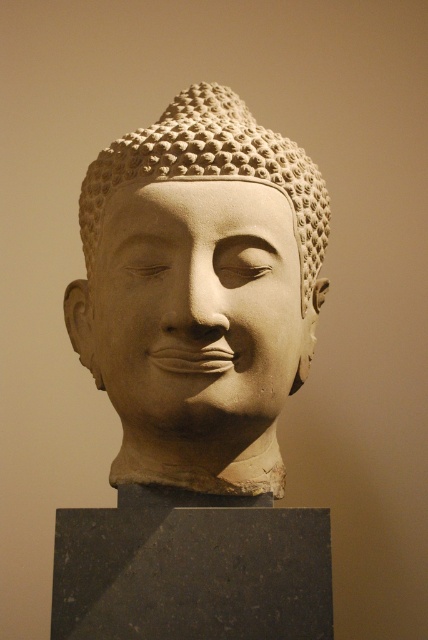
You are an art conservator assessing the dimensions of the sculpture. Given that the smooth stone face at center has a width of 30 cm, can the white stone buddha head at center fit through a doorway that is 40 cm wide?

The white stone buddha head at center might be wider than smooth stone face at center. Since the smooth stone face at center is 30 cm wide, the white stone buddha head at center could potentially exceed 40 cm in width, so it may not fit through the doorway. Further measurements are needed to confirm.

You are an art student standing in front of the sculpture. You notice two parts of the sculpture labeled as the white stone buddha head at center and the smooth stone face at center. Which part appears closer to you?

The white stone buddha head at center appears closer to you because it is further to the viewer than the smooth stone face at center.